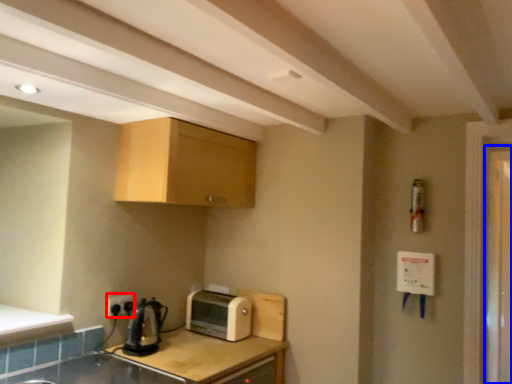
Question: Which object appears farthest to the camera in this image, electric outlet (highlighted by a red box) or screen door (highlighted by a blue box)?

Choices:
 (A) electric outlet
 (B) screen door

Answer: (B)